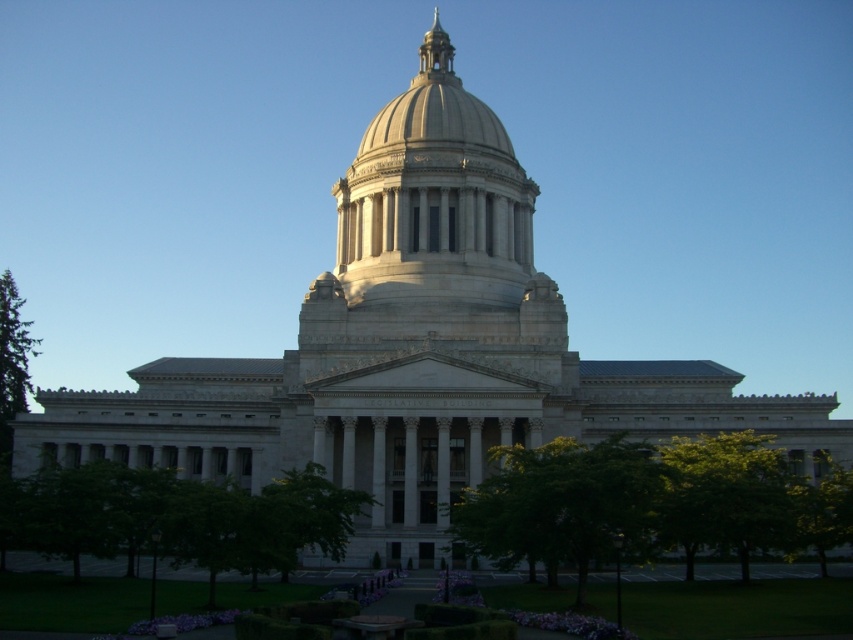
Question: Which point is closer to the camera taking this photo?

Choices:
 (A) (138, 538)
 (B) (459, 502)

Answer: (A)

Question: Does green leafy tree at lower left have a lesser width compared to green leafy tree at center?

Choices:
 (A) yes
 (B) no

Answer: (B)

Question: From the image, what is the correct spatial relationship of green leafy tree at lower left in relation to green leafy tree at center?

Choices:
 (A) below
 (B) above

Answer: (A)

Question: Is green leafy tree at lower left wider than green leafy tree at center?

Choices:
 (A) no
 (B) yes

Answer: (B)

Question: Which object appears closest to the camera in this image?

Choices:
 (A) green leafy tree at center
 (B) green leafy tree at lower left

Answer: (A)